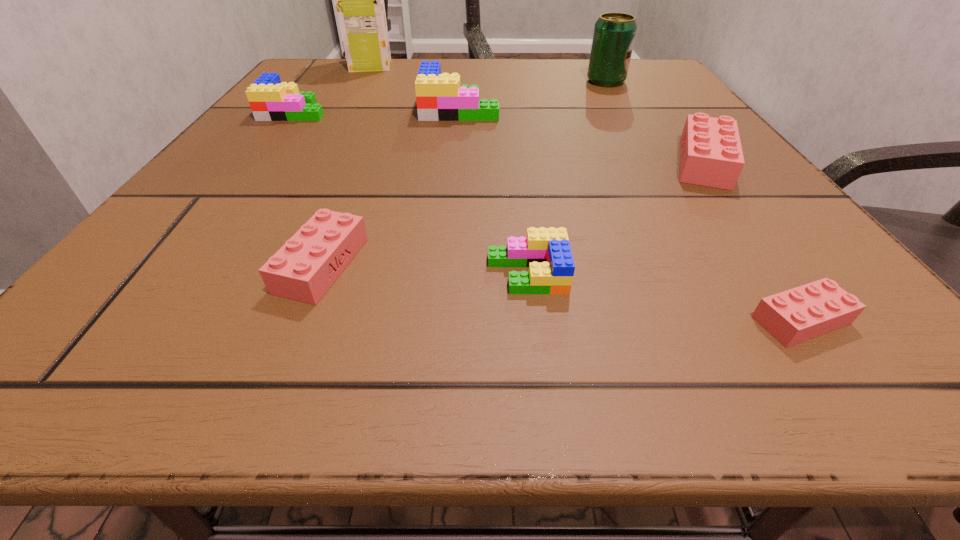
The width and height of the screenshot is (960, 540). I want to click on soya milk, so click(359, 0).

Identify the location of green soya milk. (359, 0).

I want to click on the seventh nearest object, so click(614, 34).

Find the location of a particular element. The image size is (960, 540). green beer can is located at coordinates (614, 34).

Where is `the tallest Lego`? the tallest Lego is located at coordinates (439, 97).

Identify the location of the biggest green Lego. The height and width of the screenshot is (540, 960). (439, 97).

This screenshot has height=540, width=960. I want to click on the leftmost Lego, so click(x=270, y=100).

The height and width of the screenshot is (540, 960). What are the coordinates of `the leftmost green Lego` in the screenshot? It's located at (270, 100).

This screenshot has height=540, width=960. In order to click on the third farthest Lego in this screenshot , I will do 711,155.

Identify the location of the fifth farthest object. (711, 155).